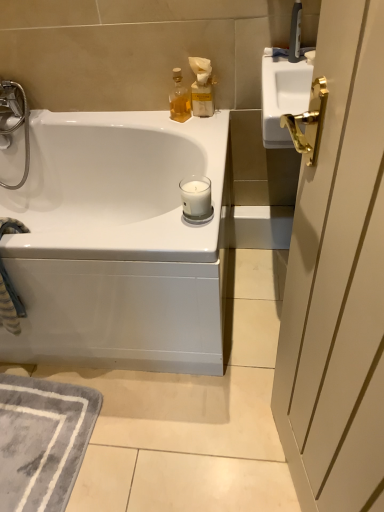
This screenshot has width=384, height=512. In order to click on free space in front of white glass candle at center in this screenshot , I will do `click(193, 233)`.